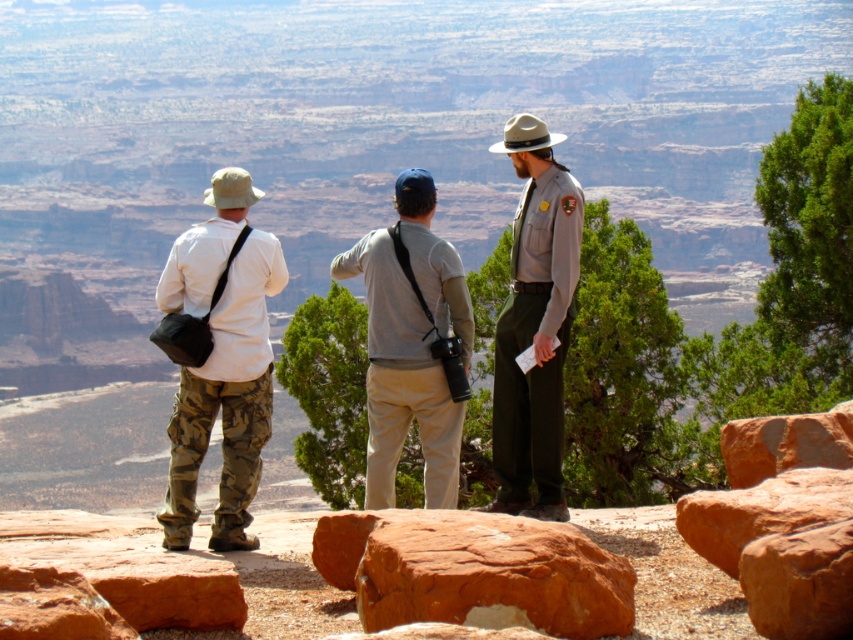
Question: Which point is farther to the camera?

Choices:
 (A) gray cotton shirt at center
 (B) camo pants at center
 (C) gray uniform at center
 (D) rusty rock at center

Answer: (C)

Question: Which point appears closest to the camera in this image?

Choices:
 (A) (444, 413)
 (B) (573, 636)

Answer: (B)

Question: Does camo pants at center have a lesser width compared to rusty rock at center?

Choices:
 (A) yes
 (B) no

Answer: (B)

Question: In this image, where is camo pants at center located relative to gray cotton shirt at center?

Choices:
 (A) left
 (B) right

Answer: (A)

Question: Which point appears farthest from the camera in this image?

Choices:
 (A) (485, 532)
 (B) (373, 266)

Answer: (B)

Question: From the image, what is the correct spatial relationship of camo pants at center in relation to gray cotton shirt at center?

Choices:
 (A) above
 (B) below

Answer: (A)